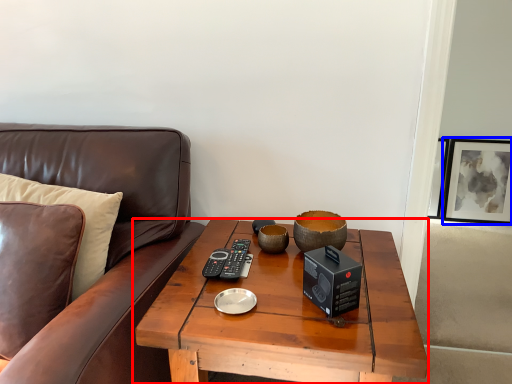
Question: Which of the following is the farthest to the observer, coffee table (highlighted by a red box) or picture frame (highlighted by a blue box)?

Choices:
 (A) coffee table
 (B) picture frame

Answer: (B)